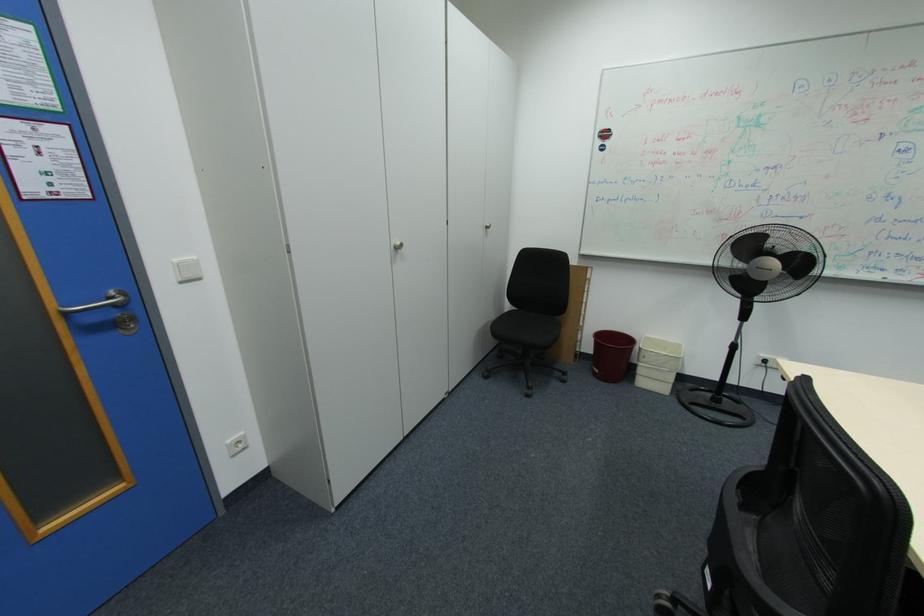
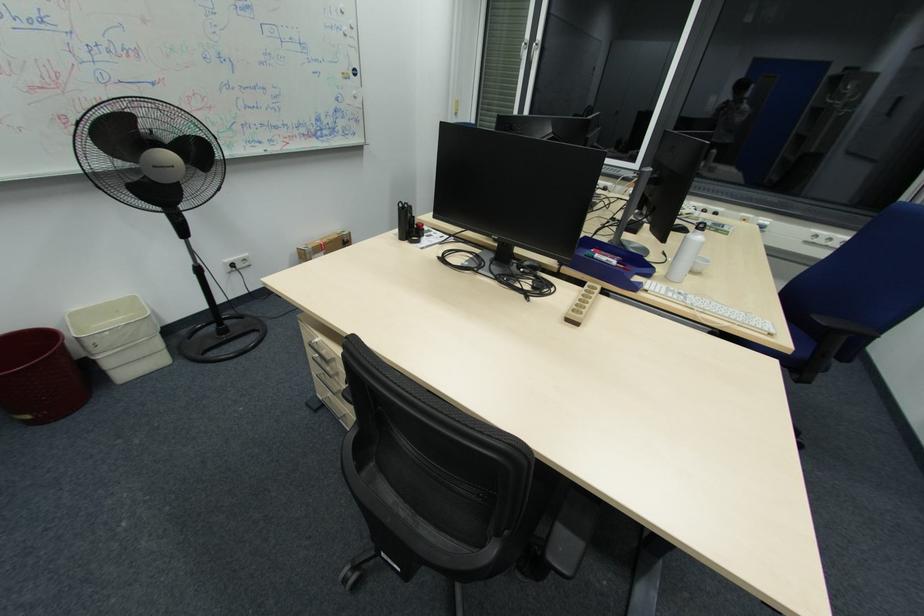
How did the camera likely rotate?

The camera rotated toward right-down.